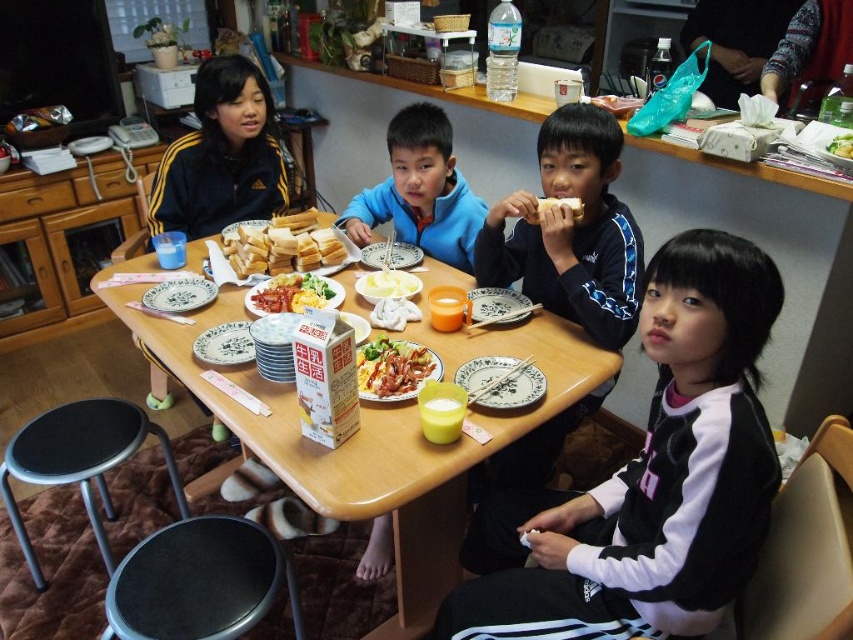
You are a parent trying to place a 10 inch long spoon on the table. The wooden table at center has the yellow creamy mashed potatoes at center on it. Can the spoon fit entirely on the table without touching the mashed potatoes?

The wooden table at center and yellow creamy mashed potatoes at center are 11.35 inches apart from each other. Since the spoon is 10 inches long, it can fit on the table without touching the mashed potatoes as there is enough space between them.

You are a parent preparing to serve dinner to your children. You have a wooden table at center and a bowl of yellow creamy mashed potatoes at center on the table. Can you place another small bowl on the table without moving the existing items?

The wooden table at center has a larger size compared to yellow creamy mashed potatoes at center, so yes, there should be enough space to place another small bowl on the table without moving the existing items.

You are a parent preparing to serve food to your children. You have a plate of yellow scrambled eggs at center and a slice of white bread at upper center. Which item is wider?

The yellow scrambled eggs at center is wider than the white bread at upper center.